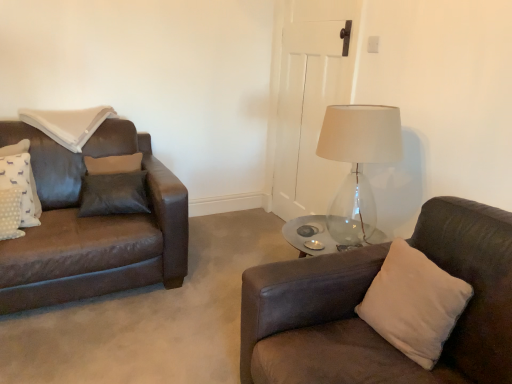
Question: Based on their positions, is beige suede pillow at right, which is the first pillow from bottom to top, located to the left or right of white fabric pillow at upper left, marked as the third pillow in a bottom-to-top arrangement?

Choices:
 (A) left
 (B) right

Answer: (B)

Question: Is beige suede pillow at right, which is the first pillow from bottom to top, wider or thinner than white fabric pillow at upper left, marked as the third pillow in a bottom-to-top arrangement?

Choices:
 (A) thin
 (B) wide

Answer: (A)

Question: Which object is positioned closest to the beige suede pillow at right, the third pillow in the top-to-bottom sequence?

Choices:
 (A) white fabric pillow at upper left, which is the 2th pillow from right to left
 (B) white dotted fabric pillow at left, the 3th pillow from the right

Answer: (B)

Question: Which is nearer to the white dotted fabric pillow at left, acting as the 1th pillow starting from the left?

Choices:
 (A) beige suede pillow at right, which is the first pillow from bottom to top
 (B) white fabric pillow at upper left, the 3th pillow viewed from the front

Answer: (B)